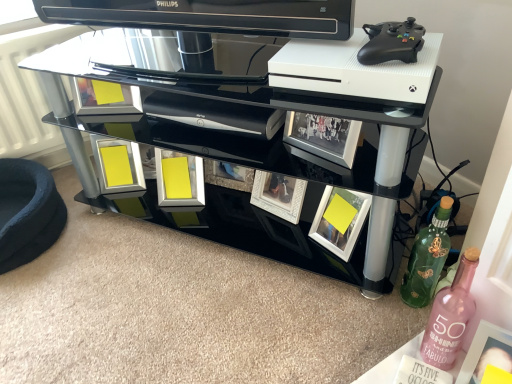
Where is `vacant area that lies between matte yellow picture frame at lower center, positioned as the 2th picture frame in back-to-front order, and white glossy magazine at lower right`? The image size is (512, 384). vacant area that lies between matte yellow picture frame at lower center, positioned as the 2th picture frame in back-to-front order, and white glossy magazine at lower right is located at coordinates (273, 279).